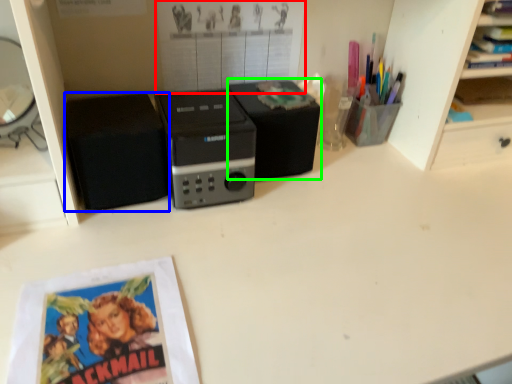
Question: Which object is the closest to the poster page (highlighted by a red box)? Choose among these: speaker (highlighted by a blue box) or speaker (highlighted by a green box).

Choices:
 (A) speaker
 (B) speaker

Answer: (B)